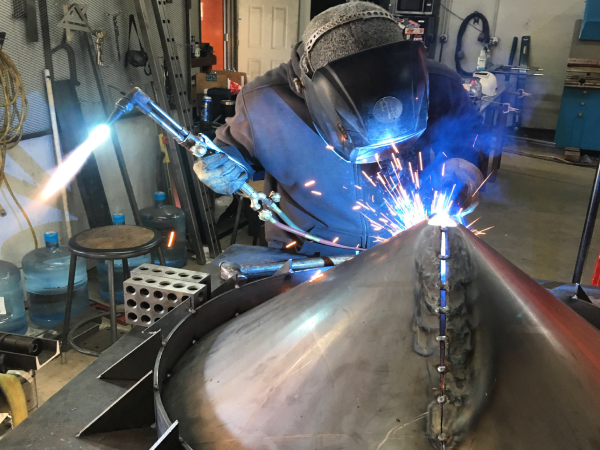
You are a GUI agent. You are given a task and a screenshot of the screen. Output one action in this format:
    pyautogui.click(x=<x>, y=<y>)
    Task: Click on the door
    
    Given the screenshot: What is the action you would take?
    pyautogui.click(x=266, y=20)